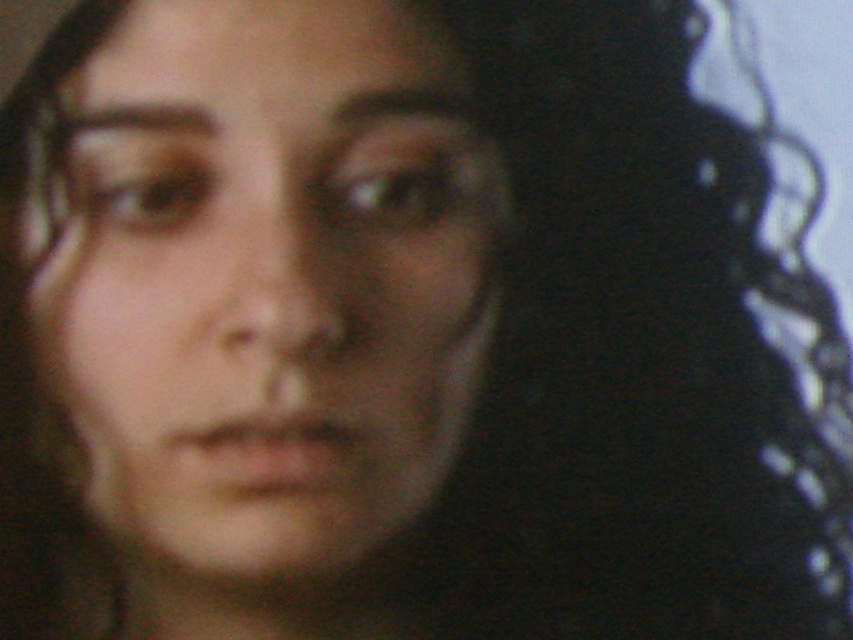
Question: Does smooth skin face at center lie in front of matte black eye at center?

Choices:
 (A) yes
 (B) no

Answer: (A)

Question: Which object is closer to the camera taking this photo?

Choices:
 (A) smooth skin face at center
 (B) brown matte eye at upper left

Answer: (A)

Question: Among these points, which one is farthest from the camera?

Choices:
 (A) (187, 189)
 (B) (349, 212)
 (C) (318, 76)

Answer: (B)

Question: Which object is farther from the camera taking this photo?

Choices:
 (A) smooth skin face at center
 (B) matte black eye at center
 (C) brown matte eye at upper left

Answer: (B)

Question: Can you confirm if smooth skin face at center is wider than brown matte eye at upper left?

Choices:
 (A) no
 (B) yes

Answer: (B)

Question: Is matte black eye at center bigger than brown matte eye at upper left?

Choices:
 (A) yes
 (B) no

Answer: (A)